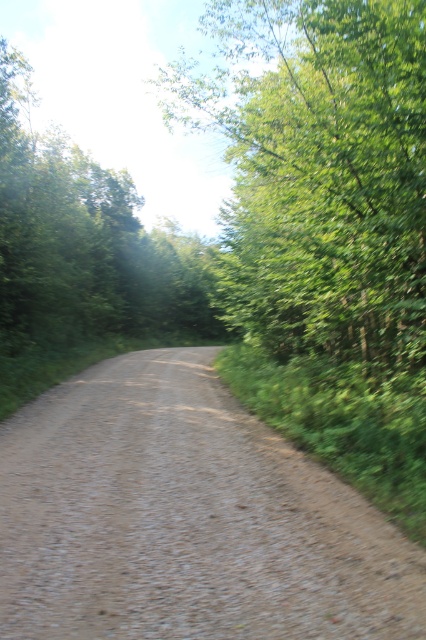
Can you confirm if green leafy tree at upper center is positioned to the right of green leafy tree at left?

Indeed, green leafy tree at upper center is positioned on the right side of green leafy tree at left.

Can you confirm if green leafy tree at upper center is taller than green leafy tree at left?

Yes.

The image size is (426, 640). Describe the element at coordinates (319, 172) in the screenshot. I see `green leafy tree at upper center` at that location.

Where is `green leafy tree at upper center`? The height and width of the screenshot is (640, 426). green leafy tree at upper center is located at coordinates (319, 172).

Does dirt/gravel road at center come in front of green leafy tree at upper center?

Yes, dirt/gravel road at center is in front of green leafy tree at upper center.

Who is more forward, (362, 616) or (396, 324)?

Positioned in front is point (362, 616).

Does point (98, 440) come behind point (256, 182)?

That is False.

I want to click on dirt/gravel road at center, so click(186, 518).

Is point (253, 497) more distant than point (65, 291)?

No, (253, 497) is closer to viewer.

Between dirt/gravel road at center and green leafy tree at left, which one is positioned higher?

green leafy tree at left

At what (x,y) coordinates should I click in order to perform the action: click on dirt/gravel road at center. Please return your answer as a coordinate pair (x, y). Looking at the image, I should click on (186, 518).